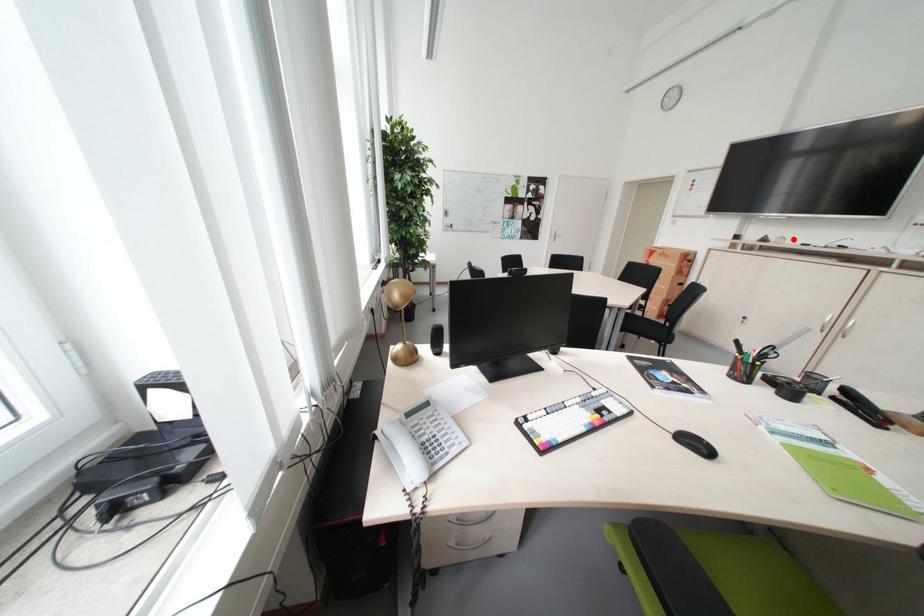
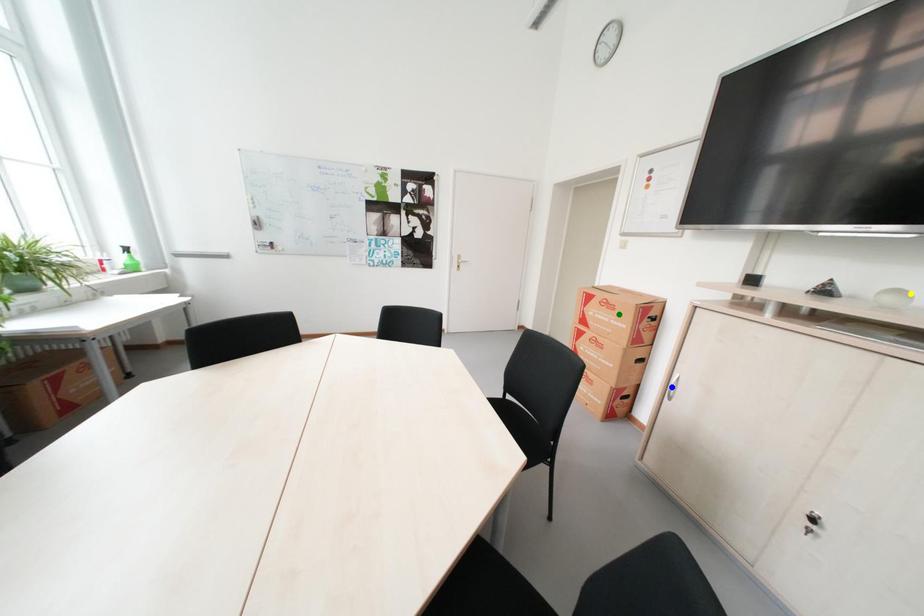
Question: I am providing you with two images of the same scene from different viewpoints. A red point is marked on the first image. You are given multiple points on the second image. Which mark in image 2 goes with the point in image 1?

Choices:
 (A) blue point
 (B) yellow point
 (C) green point

Answer: (B)